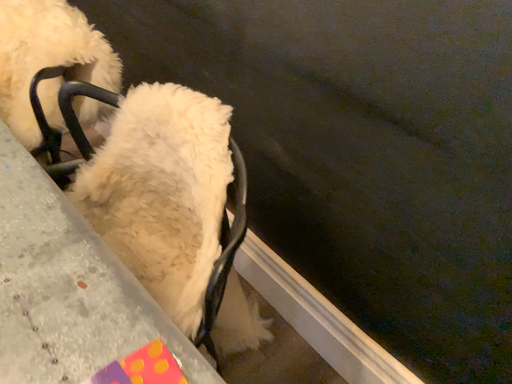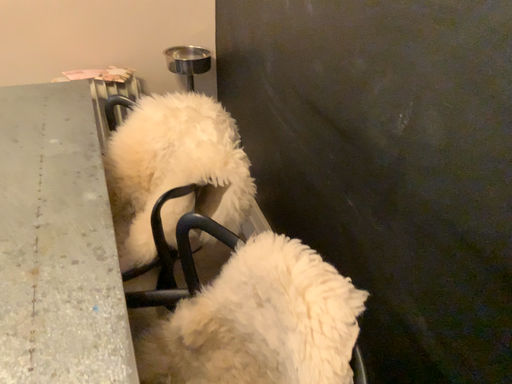
Question: Which way did the camera rotate in the video?

Choices:
 (A) rotated left
 (B) rotated right

Answer: (A)